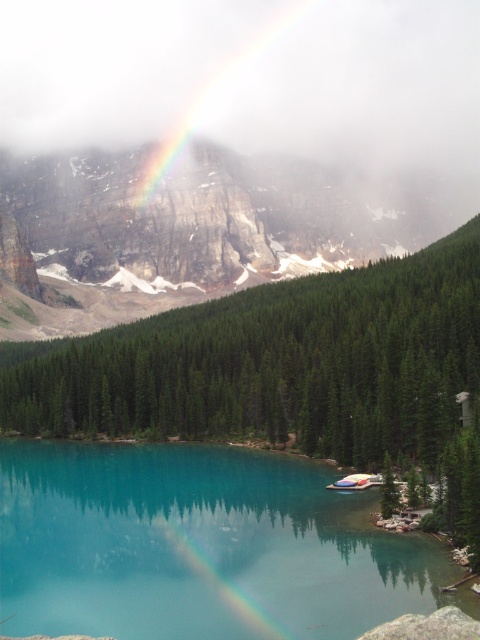
You are standing at the point marked as point (287, 371). Looking around, you see a green matte tree at center. Is the green matte tree at center located to your left or right side?

The green matte tree at center is located directly in front of you since you are standing at the point where it is situated.

You are a photographer trying to capture the rainbow at center and the turquoise glassy lake at lower center in a single shot. Based on the scene, which object will appear larger in the photo?

The turquoise glassy lake at lower center will appear larger in the photo because it is much taller than the rainbow at center according to the description.

You are standing at the center of the image and want to walk towards the green matte tree at center. In which direction should you move relative to the rainbow?

The green matte tree at center is located at point (x=287, y=371) in the image. Since you are at the center, you would need to move slightly to the right and upwards to reach the green matte tree at center, as its coordinates are to the northeast of the center point.